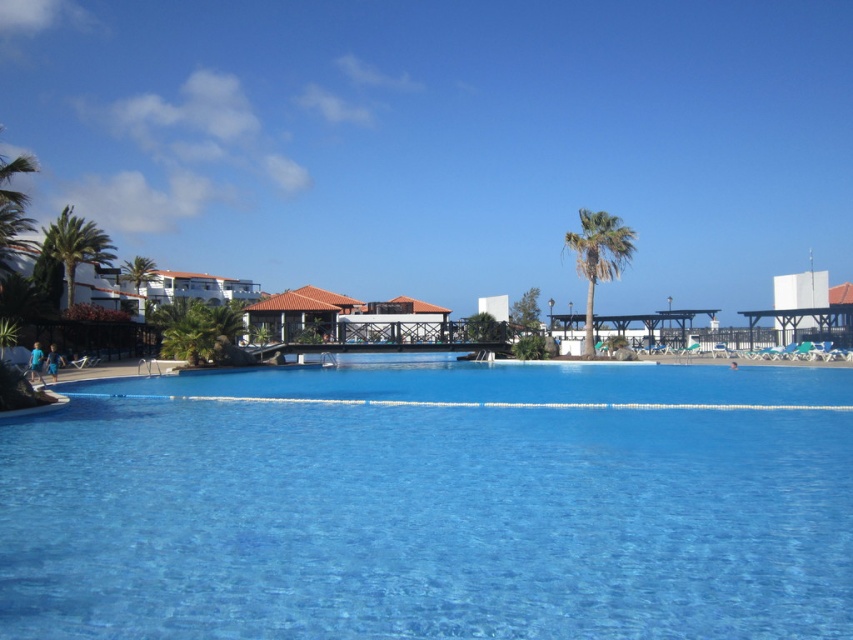
You are planning to take a photo of the transparent glass pool at center and the green leafy palm tree at center from the left side of the pool. Which object will appear closer to the camera in the photo?

The transparent glass pool at center will appear closer to the camera in the photo because it has a smaller size compared to the green leafy palm tree at center.